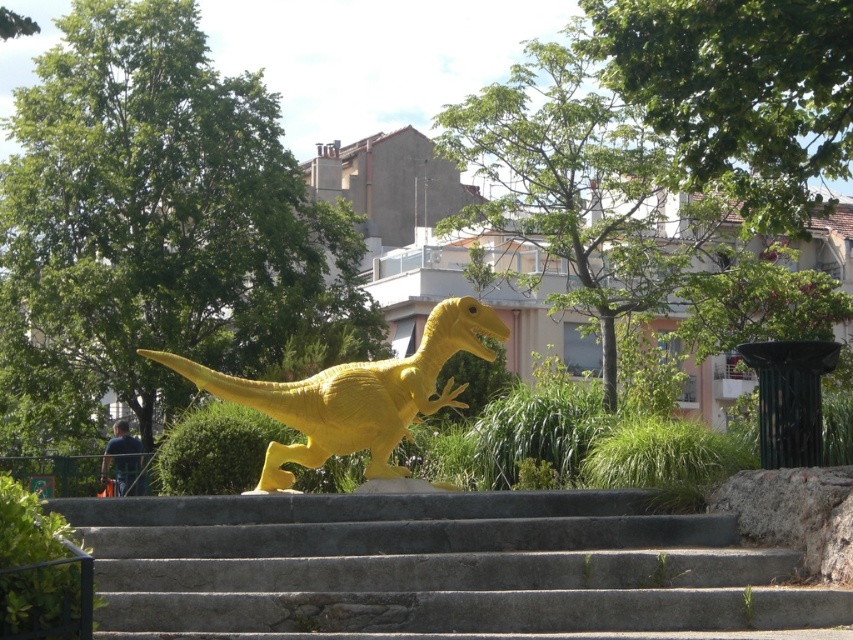
How much distance is there between gray concrete stairs at center and matte yellow dinosaur at center?

The distance of gray concrete stairs at center from matte yellow dinosaur at center is 27.92 feet.

Does gray concrete stairs at center appear on the right side of matte yellow dinosaur at center?

Correct, you'll find gray concrete stairs at center to the right of matte yellow dinosaur at center.

Image resolution: width=853 pixels, height=640 pixels. I want to click on gray concrete stairs at center, so point(439,570).